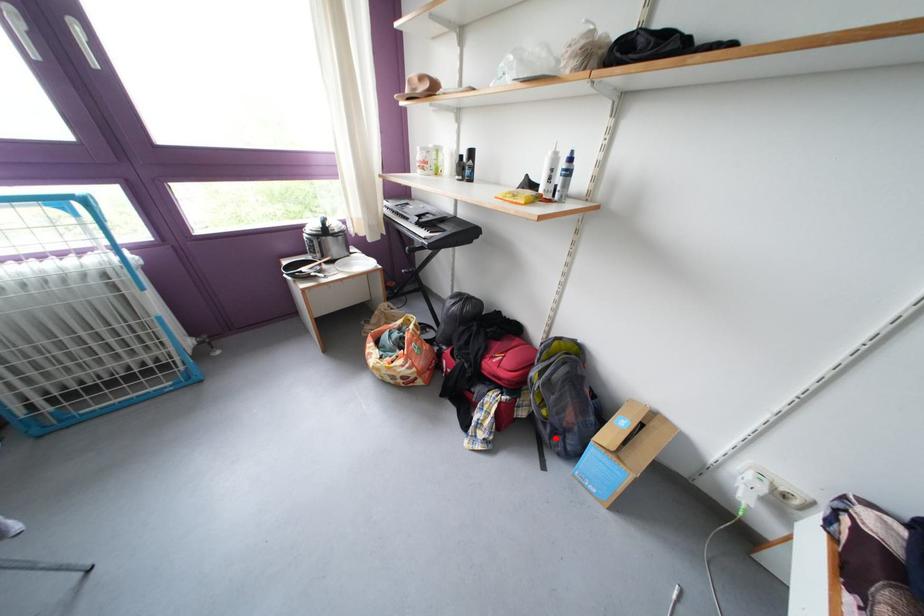
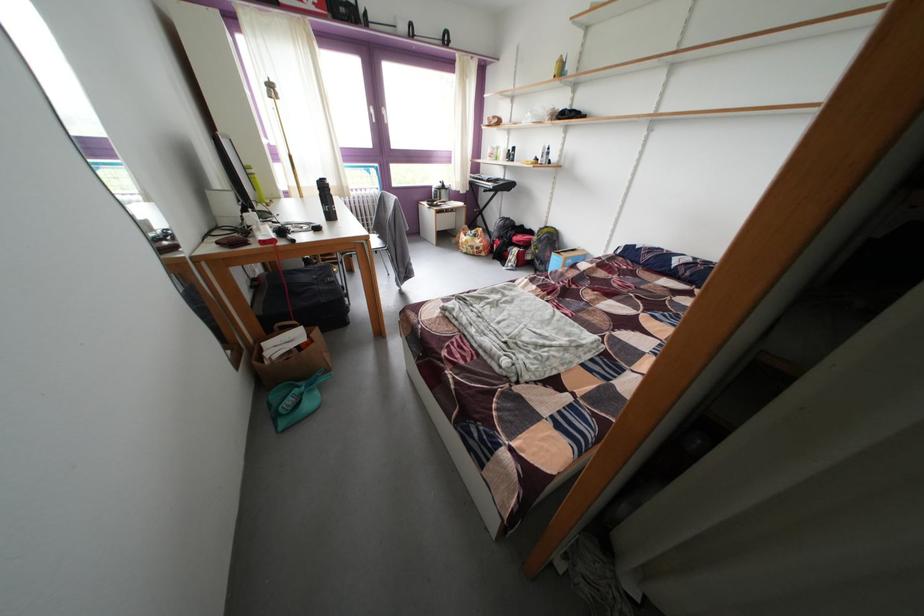
The point at the highlighted location is marked in the first image. Where is the corresponding point in the second image?

(548, 269)